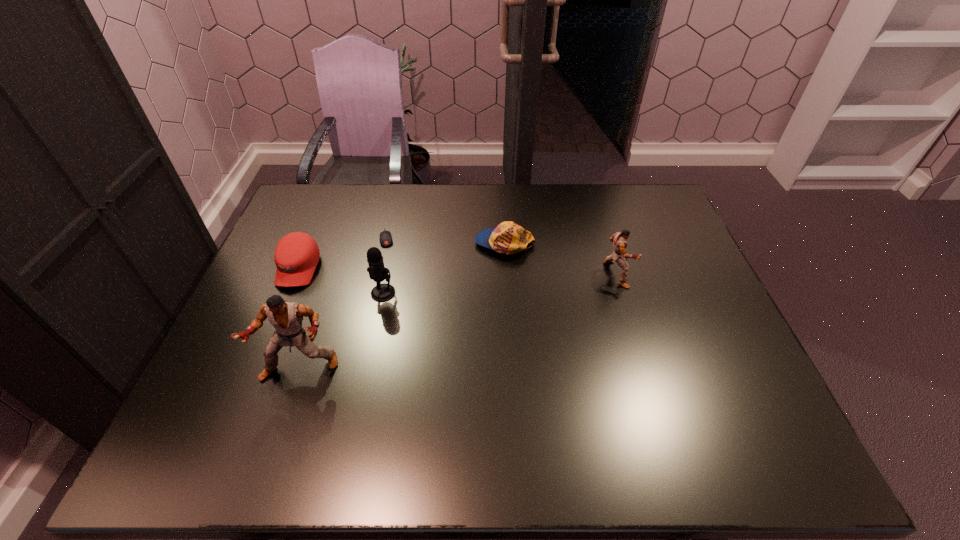
The height and width of the screenshot is (540, 960). Find the location of `free spot between the microphone and the shorter puncher`. free spot between the microphone and the shorter puncher is located at coordinates (500, 284).

Where is `vacant point located between the left puncher and the second object from right to left`? This screenshot has height=540, width=960. vacant point located between the left puncher and the second object from right to left is located at coordinates (402, 306).

Locate an element on the screen. This screenshot has height=540, width=960. unoccupied position between the shorter puncher and the left cap is located at coordinates (457, 272).

The image size is (960, 540). What are the coordinates of `free space that is in between the left cap and the right puncher` in the screenshot? It's located at (457, 272).

Find the location of a particular element. Image resolution: width=960 pixels, height=540 pixels. free spot between the fifth object from left to right and the shortest object is located at coordinates (445, 241).

Where is `vacant point located between the shortest object and the tallest object`? Image resolution: width=960 pixels, height=540 pixels. vacant point located between the shortest object and the tallest object is located at coordinates (344, 303).

Find the location of `vacant space in between the microphone and the left cap`. vacant space in between the microphone and the left cap is located at coordinates (341, 281).

Locate an element on the screen. the third closest object to the microphone is located at coordinates (296, 255).

This screenshot has width=960, height=540. Identify the location of the fifth closest object relative to the left puncher. (619, 241).

The image size is (960, 540). Find the location of `vacant space that satisfies the following two spatial constraints: 1. on the bill of the right cap; 2. on the front side of the microphone`. vacant space that satisfies the following two spatial constraints: 1. on the bill of the right cap; 2. on the front side of the microphone is located at coordinates (508, 293).